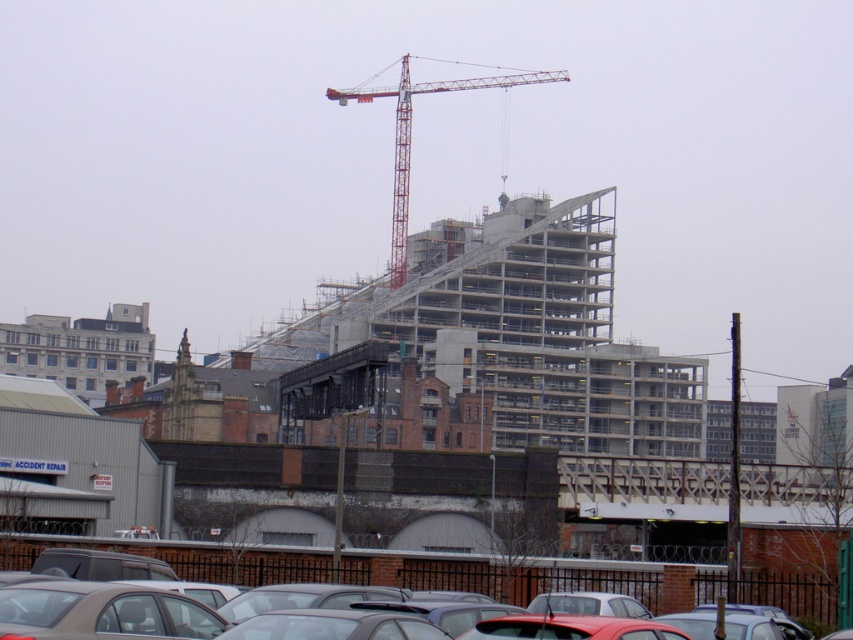
Question: Among these objects, which one is farthest from the camera?

Choices:
 (A) matte gray car at lower center
 (B) matte gray sedan at center

Answer: (B)

Question: Can you confirm if matte gray car at lower center is bigger than shiny red car at center?

Choices:
 (A) yes
 (B) no

Answer: (B)

Question: Considering the real-world distances, which object is closest to the red metal crane at upper center?

Choices:
 (A) shiny red car at center
 (B) matte gray sedan at center
 (C) matte gray car at lower center

Answer: (B)

Question: Is silver metallic sedan at lower left to the right of red metal crane at upper center from the viewer's perspective?

Choices:
 (A) no
 (B) yes

Answer: (B)

Question: Does silver metallic sedan at lower left have a smaller size compared to red metal crane at upper center?

Choices:
 (A) yes
 (B) no

Answer: (A)

Question: Which point is closer to the camera taking this photo?

Choices:
 (A) (474, 572)
 (B) (473, 83)

Answer: (A)